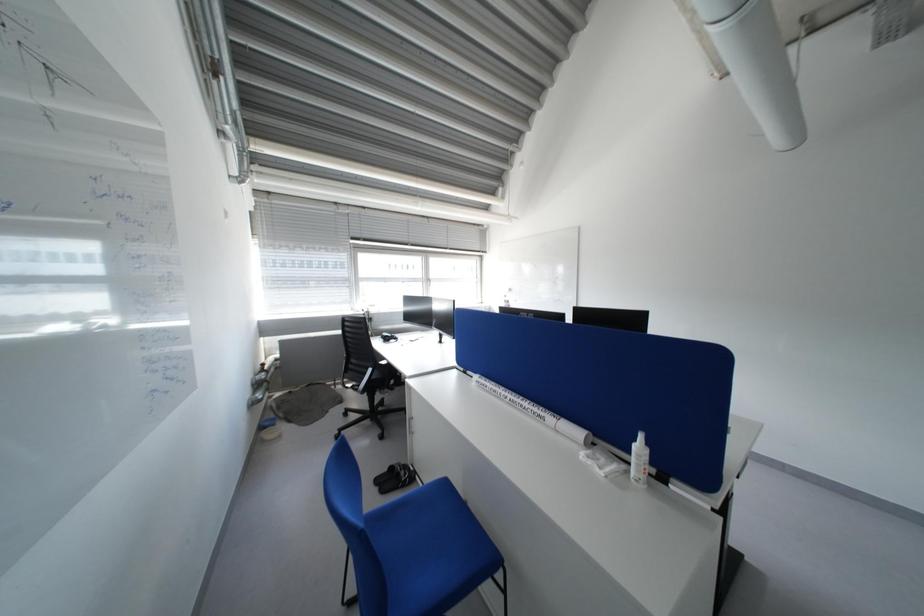
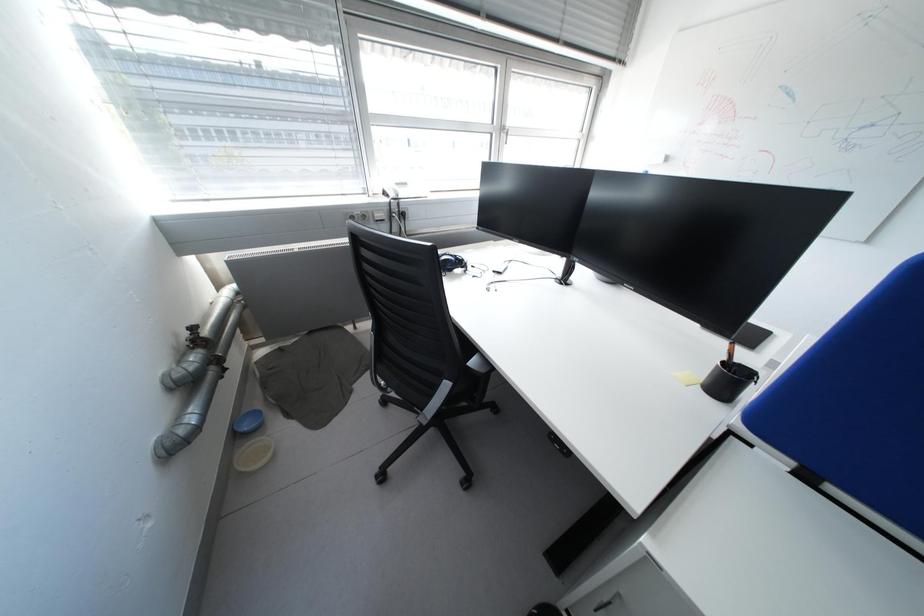
Based on the photo, in a continuous first-person perspective shot, in which direction is the camera moving?

The movement direction of the cameraman is left, forward.